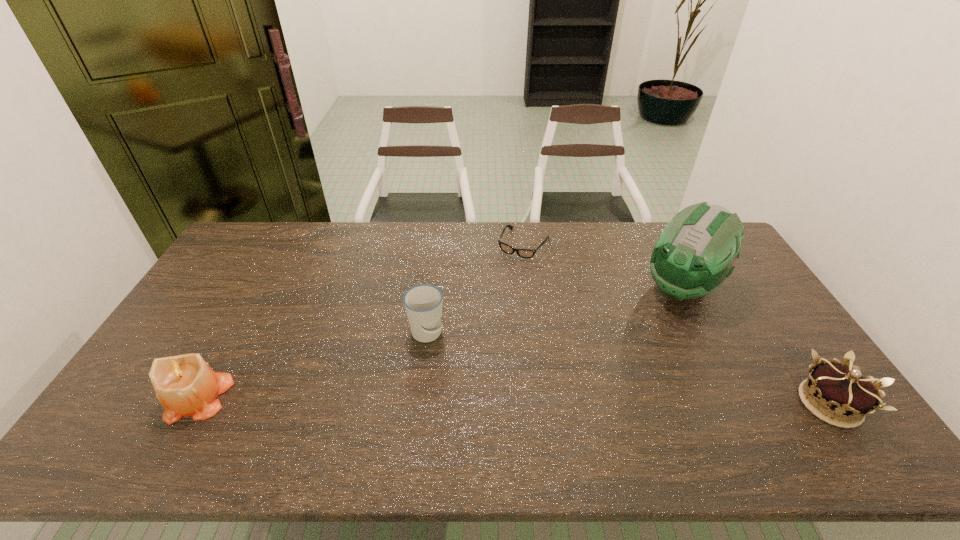
The height and width of the screenshot is (540, 960). I want to click on vacant spot on the desktop that is between the candle and the crown and is positioned with a handle on the side of the cup, so click(x=462, y=400).

Where is `free space on the desktop that is between the leftmost object and the crown and is positioned on the front-facing side of the third object from right to left`? free space on the desktop that is between the leftmost object and the crown and is positioned on the front-facing side of the third object from right to left is located at coordinates 432,400.

This screenshot has height=540, width=960. In order to click on vacant space on the desktop that is between the leftmost object and the crown and is positioned on the visor of the tallest object in this screenshot , I will do `click(575, 401)`.